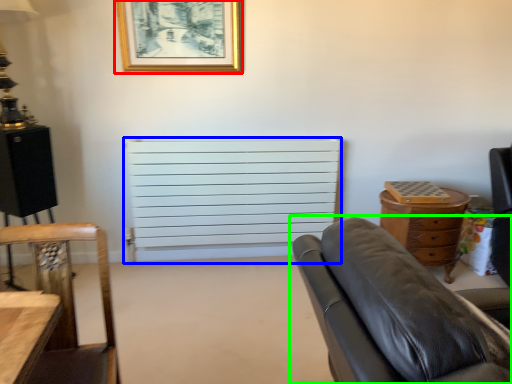
Question: Estimate the real-world distances between objects in this image. Which object is farther from picture frame (highlighted by a red box), radiator (highlighted by a blue box) or studio couch (highlighted by a green box)?

Choices:
 (A) radiator
 (B) studio couch

Answer: (B)